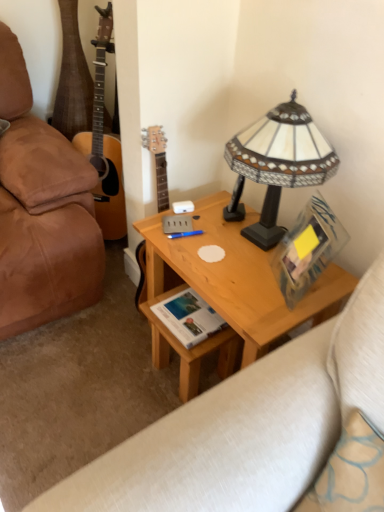
Question: From a real-world perspective, is white paper book at center located beneath light wood desk at center?

Choices:
 (A) yes
 (B) no

Answer: (B)

Question: Can you confirm if white paper book at center is wider than light wood desk at center?

Choices:
 (A) no
 (B) yes

Answer: (A)

Question: Is white paper book at center aimed at light wood desk at center?

Choices:
 (A) yes
 (B) no

Answer: (A)

Question: Is white paper book at center not near light wood desk at center?

Choices:
 (A) yes
 (B) no

Answer: (B)

Question: Is white paper book at center next to light wood desk at center and touching it?

Choices:
 (A) no
 (B) yes

Answer: (A)

Question: From a real-world perspective, is leather studio couch at lower left positioned above or below white paper book at center?

Choices:
 (A) below
 (B) above

Answer: (A)

Question: Which is correct: leather studio couch at lower left is inside white paper book at center, or outside of it?

Choices:
 (A) outside
 (B) inside

Answer: (A)

Question: In the image, is leather studio couch at lower left on the left side or the right side of white paper book at center?

Choices:
 (A) right
 (B) left

Answer: (B)

Question: From the image's perspective, relative to white paper book at center, is leather studio couch at lower left above or below?

Choices:
 (A) below
 (B) above

Answer: (A)

Question: Based on their sizes in the image, would you say white paper book at center is bigger or smaller than blue plastic pen at center?

Choices:
 (A) big
 (B) small

Answer: (A)

Question: From their relative heights in the image, would you say white paper book at center is taller or shorter than blue plastic pen at center?

Choices:
 (A) short
 (B) tall

Answer: (B)

Question: Relative to blue plastic pen at center, is white paper book at center in front or behind?

Choices:
 (A) behind
 (B) front

Answer: (B)

Question: Considering the positions of point (185, 296) and point (190, 234), is point (185, 296) closer or farther from the camera than point (190, 234)?

Choices:
 (A) closer
 (B) farther

Answer: (B)

Question: Considering the positions of blue plastic pen at center and leather studio couch at lower left in the image, is blue plastic pen at center taller or shorter than leather studio couch at lower left?

Choices:
 (A) tall
 (B) short

Answer: (B)

Question: Does point (180, 234) appear closer or farther from the camera than point (168, 420)?

Choices:
 (A) closer
 (B) farther

Answer: (B)